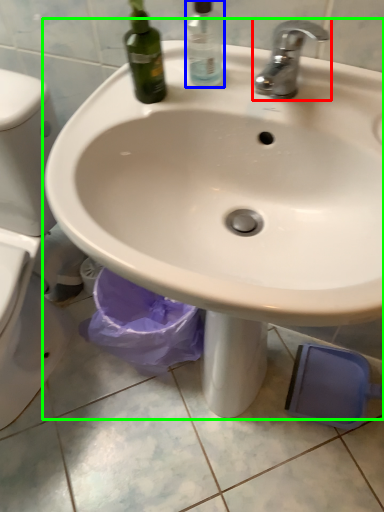
Question: Considering the real-world distances, which object is closest to tap (highlighted by a red box)? cleaning product (highlighted by a blue box) or sink (highlighted by a green box).

Choices:
 (A) cleaning product
 (B) sink

Answer: (A)